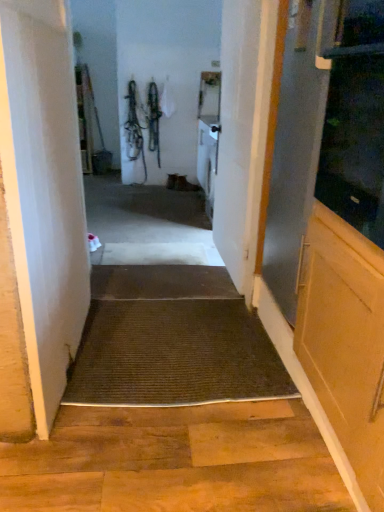
At what (x,y) coordinates should I click in order to perform the action: click on empty space that is ontop of brown textured mat at center, the 1th doormat in the top-to-bottom sequence (from a real-world perspective). Please return your answer as a coordinate pair (x, y). Looking at the image, I should click on (167, 281).